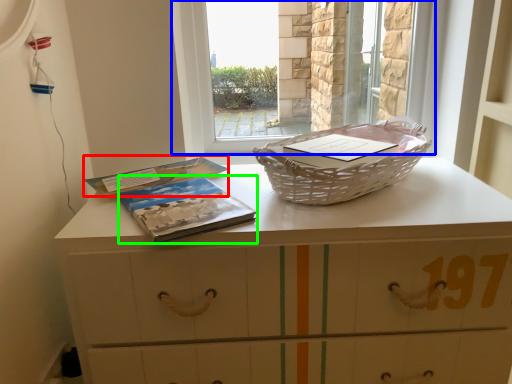
Question: Which is farther away from paperback book (highlighted by a red box)? window (highlighted by a blue box) or paperback book (highlighted by a green box)?

Choices:
 (A) window
 (B) paperback book

Answer: (A)